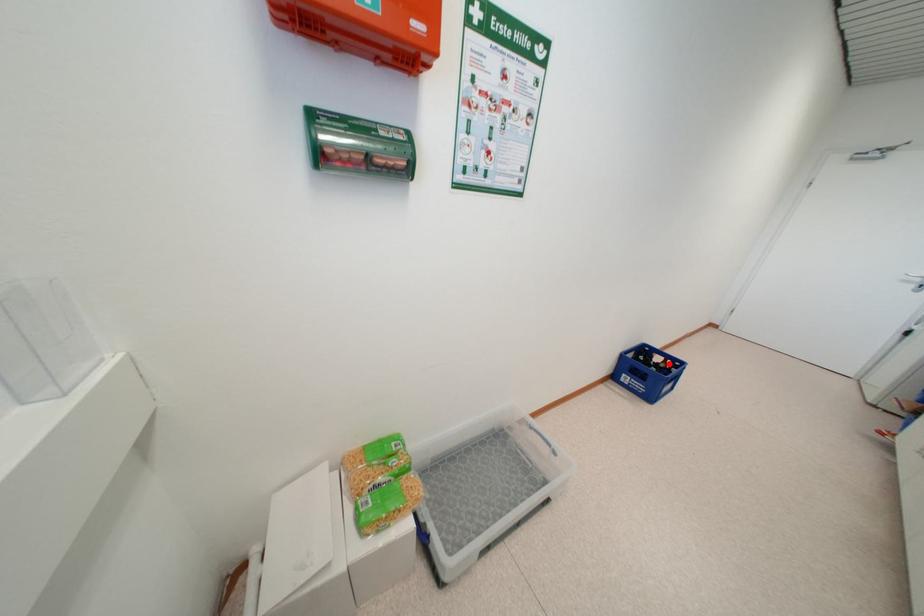
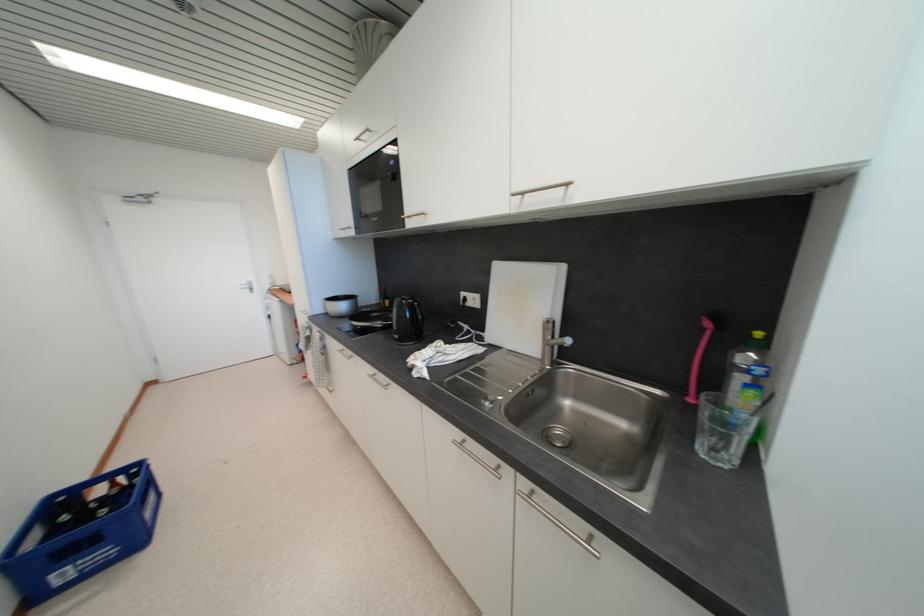
Question: I am providing you with two images of the same scene from different viewpoints. A red point is marked on the first image. Is the red point's position out of view in image 2?

Choices:
 (A) Yes
 (B) No

Answer: (B)